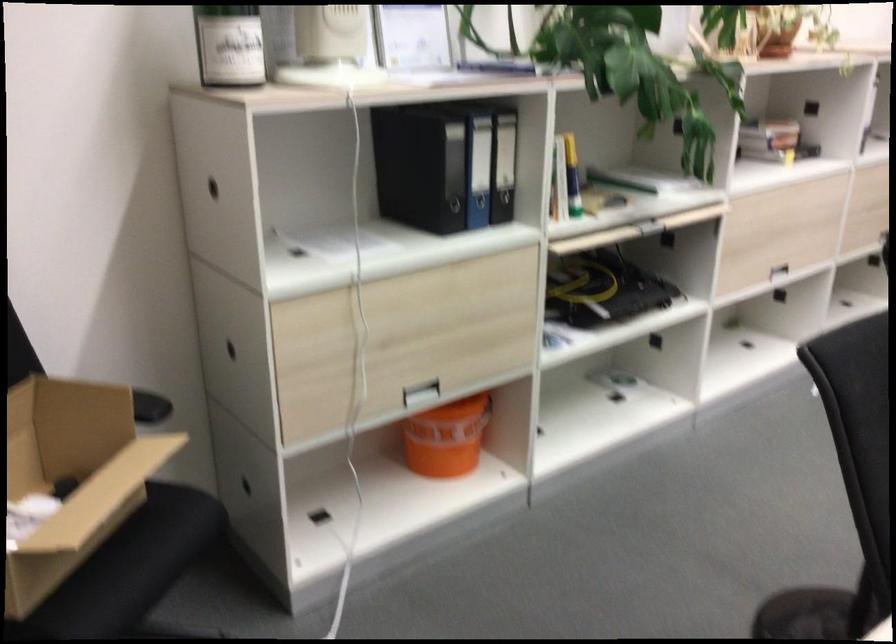
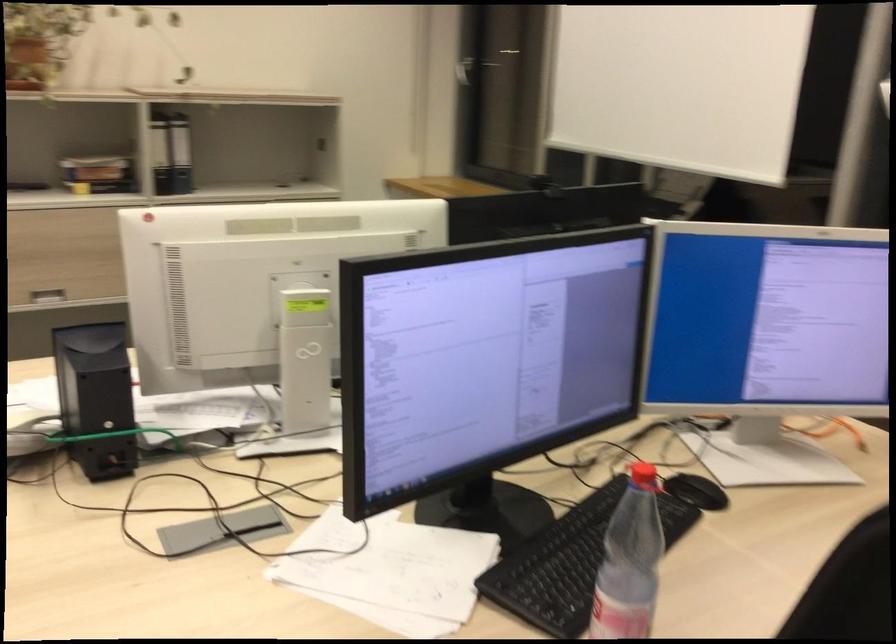
Question: The images are taken continuously from a first-person perspective. In which direction are you moving?

Choices:
 (A) Left
 (B) Right
 (C) Forward
 (D) Backward

Answer: (B)